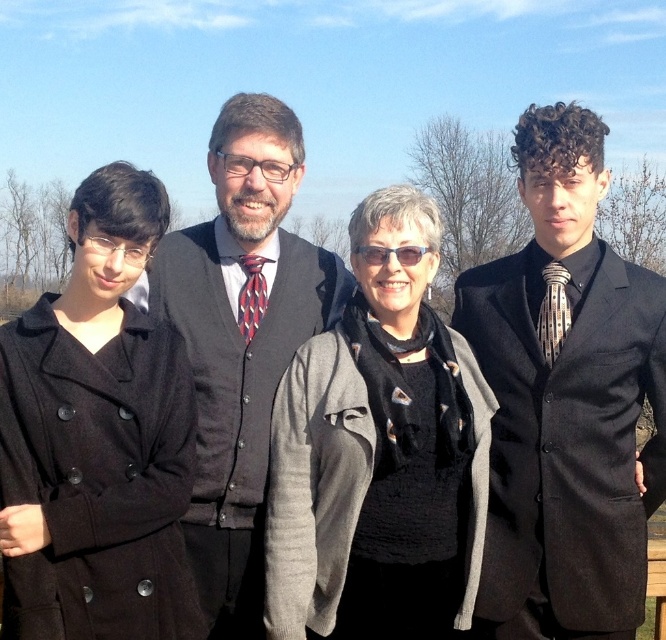
Question: Which of the following is the closest to the observer?

Choices:
 (A) matte black sweater vest at center
 (B) shiny black suit at right

Answer: (A)

Question: Is black textured scarf at center to the left of patterned silk tie at right from the viewer's perspective?

Choices:
 (A) yes
 (B) no

Answer: (A)

Question: Does shiny black suit at right appear over patterned silk tie at right?

Choices:
 (A) yes
 (B) no

Answer: (B)

Question: Which of the following is the farthest from the observer?

Choices:
 (A) (23, 355)
 (B) (565, 445)
 (C) (240, 330)

Answer: (C)

Question: Can you confirm if shiny black suit at right is smaller than patterned silk tie at right?

Choices:
 (A) no
 (B) yes

Answer: (A)

Question: Which object appears closest to the camera in this image?

Choices:
 (A) matte black coat at left
 (B) shiny black suit at right

Answer: (A)